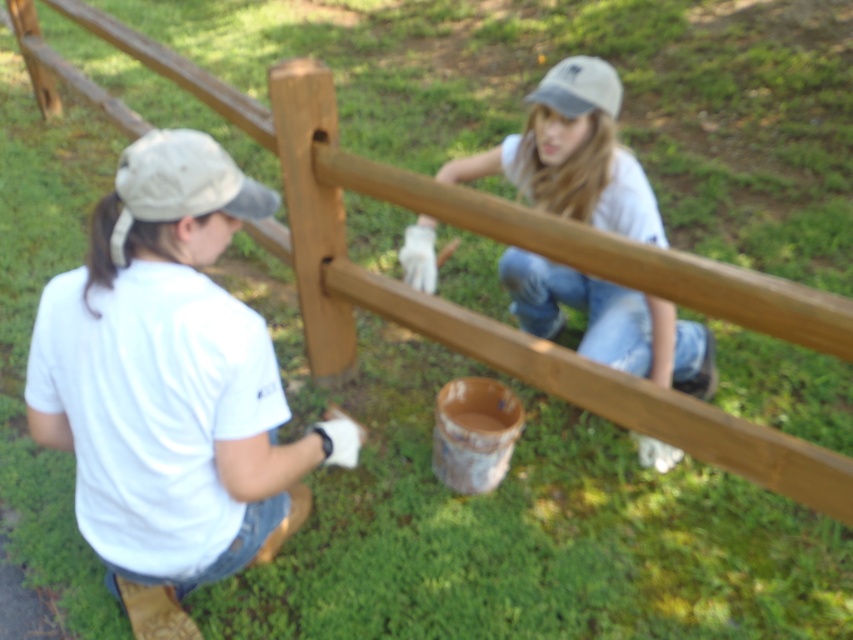
Based on the photo, who is taller, white matte shirt at left or white fabric baseball cap at upper left?

white matte shirt at left is taller.

Can you confirm if white matte shirt at left is positioned to the right of white fabric baseball cap at upper left?

In fact, white matte shirt at left is to the left of white fabric baseball cap at upper left.

Which is behind, point (242, 451) or point (123, 157)?

The point (242, 451) is more distant.

Where is `white matte shirt at left`? white matte shirt at left is located at coordinates (171, 378).

Between white matte shirt at left and white fabric baseball cap at upper center, which one is positioned higher?

white fabric baseball cap at upper center is higher up.

How much distance is there between white matte shirt at left and white fabric baseball cap at upper center?

4.20 feet

Image resolution: width=853 pixels, height=640 pixels. I want to click on white matte shirt at left, so (171, 378).

Identify the location of white matte shirt at left. (171, 378).

Is point (120, 340) positioned in front of point (607, 324)?

Yes, point (120, 340) is closer to viewer.

Between white matte shirt at left and matte white shirt at center, which one appears on the left side from the viewer's perspective?

white matte shirt at left is more to the left.

Is point (270, 365) closer to camera compared to point (544, 305)?

Yes, point (270, 365) is closer to viewer.

You are a GUI agent. You are given a task and a screenshot of the screen. Output one action in this format:
    pyautogui.click(x=<x>, y=<y>)
    Task: Click on the white matte shirt at left
    
    Given the screenshot: What is the action you would take?
    pyautogui.click(x=171, y=378)